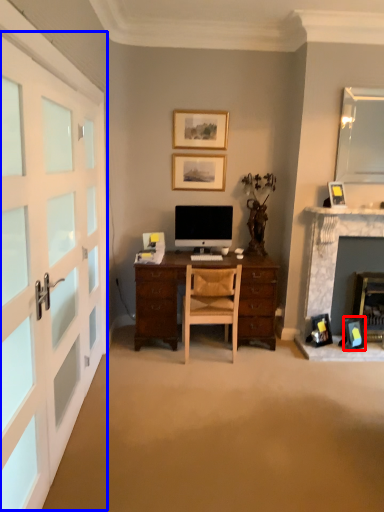
Question: Which of the following is the closest to the observer, picture frame (highlighted by a red box) or garage door (highlighted by a blue box)?

Choices:
 (A) picture frame
 (B) garage door

Answer: (B)